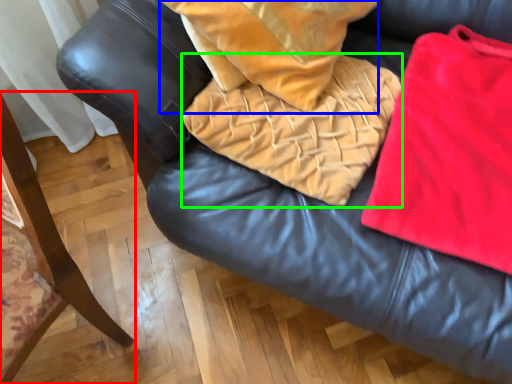
Question: Which is farther away from furniture (highlighted by a red box)? throw pillow (highlighted by a blue box) or blanket (highlighted by a green box)?

Choices:
 (A) throw pillow
 (B) blanket

Answer: (A)